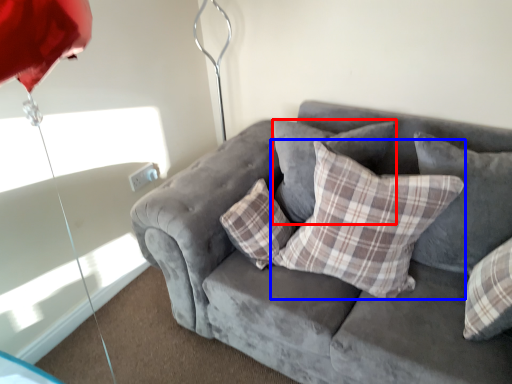
Question: Which point is further to the camera, pillow (highlighted by a red box) or pillow (highlighted by a blue box)?

Choices:
 (A) pillow
 (B) pillow

Answer: (A)